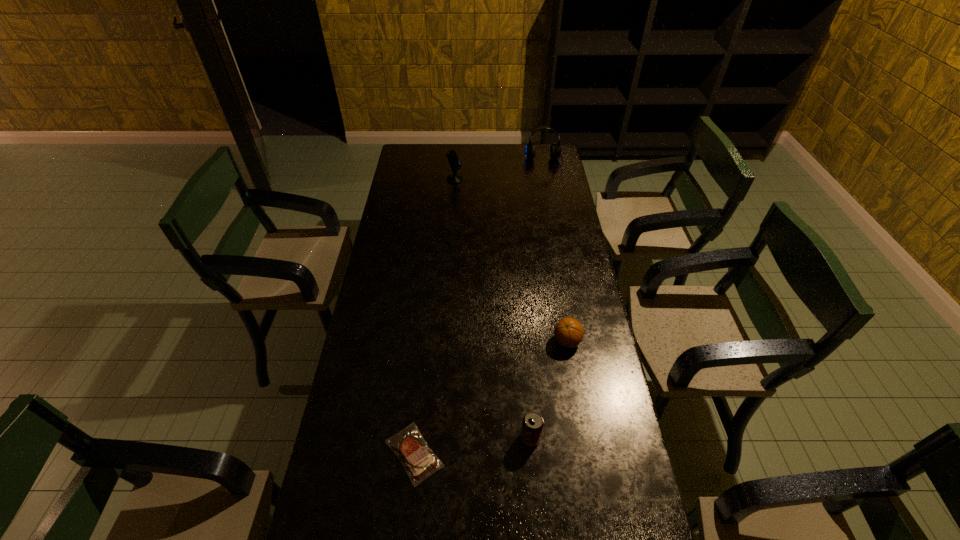
Locate an element on the screen. free point between the shortest object and the third nearest object is located at coordinates (491, 397).

At what (x,y) coordinates should I click in order to perform the action: click on free space that is in between the microphone and the shortest object. Please return your answer as a coordinate pair (x, y). The height and width of the screenshot is (540, 960). Looking at the image, I should click on (435, 316).

This screenshot has width=960, height=540. What are the coordinates of `free space between the steak and the third nearest object` in the screenshot? It's located at (491, 397).

Locate an element on the screen. Image resolution: width=960 pixels, height=540 pixels. vacant point located between the third object from right to left and the orange is located at coordinates (549, 389).

Identify the location of empty location between the shortest object and the orange. This screenshot has height=540, width=960. (491, 397).

Where is `vacant area between the soda can and the microphone`? This screenshot has height=540, width=960. vacant area between the soda can and the microphone is located at coordinates (492, 308).

The image size is (960, 540). Find the location of `blank region between the soda can and the microphone`. blank region between the soda can and the microphone is located at coordinates (492, 308).

The height and width of the screenshot is (540, 960). In order to click on vacant area between the farthest object and the fourth nearest object in this screenshot , I will do `click(499, 172)`.

Identify which object is located as the fourth nearest to the orange. Please provide its 2D coordinates. Your answer should be formatted as a tuple, i.e. [(x, y)], where the tuple contains the x and y coordinates of a point satisfying the conditions above.

[(555, 150)]

Where is `object that stands as the fourth closest to the orange`? Image resolution: width=960 pixels, height=540 pixels. object that stands as the fourth closest to the orange is located at coordinates click(x=555, y=150).